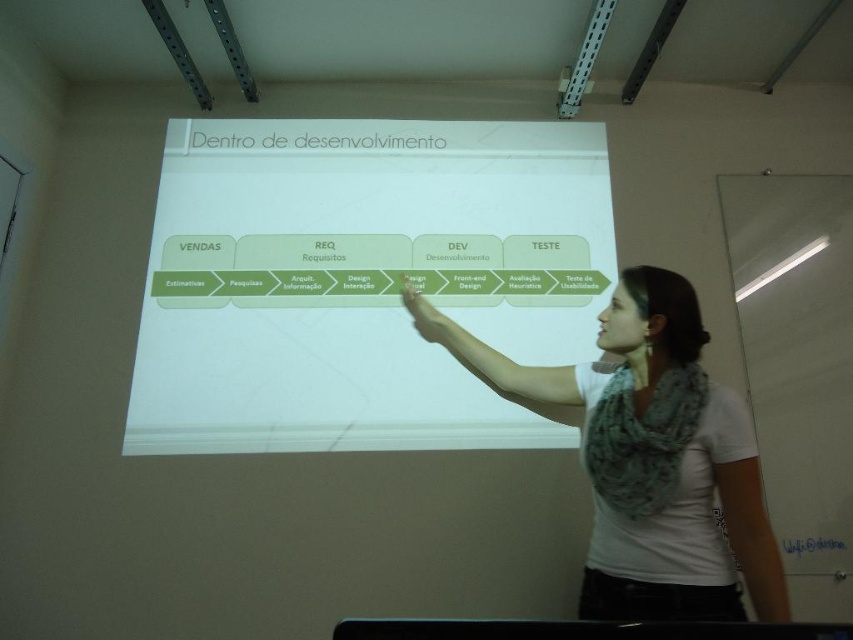
Question: Can you confirm if white matte projection screen at center is positioned to the right of white fabric scarf at upper right?

Choices:
 (A) no
 (B) yes

Answer: (A)

Question: Is white matte projection screen at center to the left of white fabric scarf at upper right from the viewer's perspective?

Choices:
 (A) yes
 (B) no

Answer: (A)

Question: Which of the following is the farthest from the observer?

Choices:
 (A) (601, 397)
 (B) (424, 356)

Answer: (B)

Question: Which point is closer to the camera?

Choices:
 (A) white fabric scarf at upper right
 (B) white matte projection screen at center

Answer: (A)

Question: Can you confirm if white matte projection screen at center is wider than white fabric scarf at upper right?

Choices:
 (A) yes
 (B) no

Answer: (A)